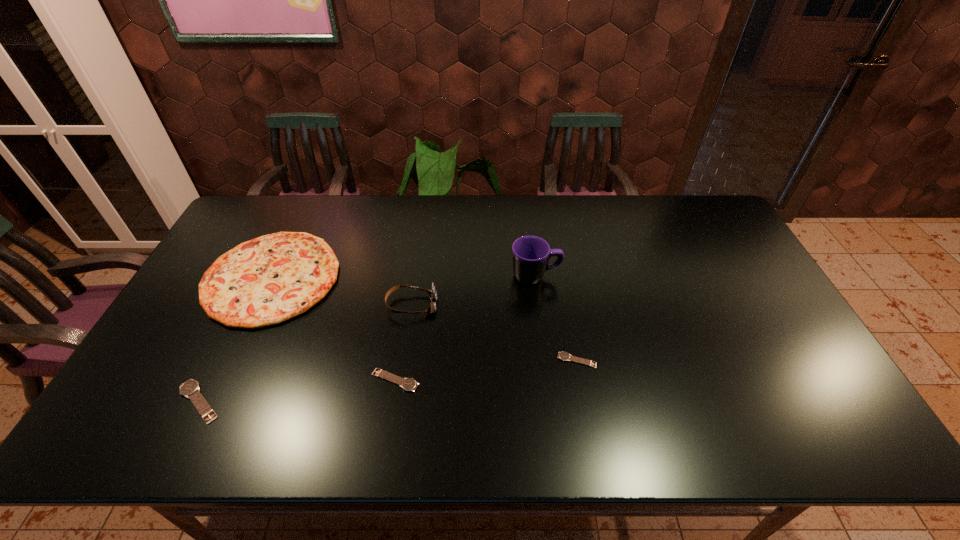
Please point out where to position a new watch on the right to maintain spacing. Please provide its 2D coordinates. Your answer should be formatted as a tuple, i.e. [(x, y)], where the tuple contains the x and y coordinates of a point satisfying the conditions above.

[(746, 342)]